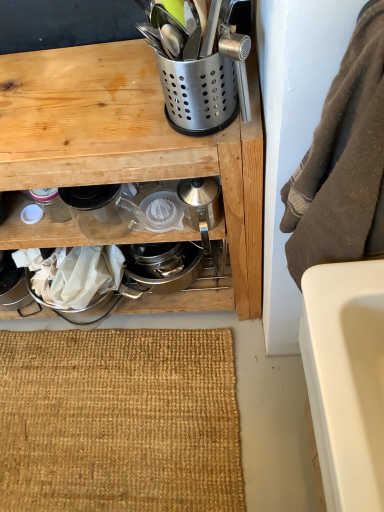
Question: Considering the relative sizes of silver metallic kettle at center, marked as the fifth appliance in a left-to-right arrangement, and clear glass pitcher at center, arranged as the 2th appliance when viewed from the left, in the image provided, is silver metallic kettle at center, marked as the fifth appliance in a left-to-right arrangement, thinner than clear glass pitcher at center, arranged as the 2th appliance when viewed from the left,?

Choices:
 (A) no
 (B) yes

Answer: (B)

Question: Is silver metallic kettle at center, marked as the fifth appliance in a left-to-right arrangement, facing away from clear glass pitcher at center, arranged as the 2th appliance when viewed from the left?

Choices:
 (A) no
 (B) yes

Answer: (A)

Question: Can you confirm if silver metallic kettle at center, which is the first appliance from right to left, is smaller than clear glass pitcher at center, the fourth appliance viewed from the right?

Choices:
 (A) no
 (B) yes

Answer: (B)

Question: Does silver metallic kettle at center, which is the first appliance from right to left, have a greater width compared to clear glass pitcher at center, the fourth appliance viewed from the right?

Choices:
 (A) no
 (B) yes

Answer: (A)

Question: Is the surface of silver metallic kettle at center, marked as the fifth appliance in a left-to-right arrangement, in direct contact with clear glass pitcher at center, the fourth appliance viewed from the right?

Choices:
 (A) yes
 (B) no

Answer: (B)

Question: From a real-world perspective, is metallic silver utensil holder at upper center positioned above or below burlap mat at lower center?

Choices:
 (A) below
 (B) above

Answer: (B)

Question: In the image, is metallic silver utensil holder at upper center positioned in front of or behind burlap mat at lower center?

Choices:
 (A) front
 (B) behind

Answer: (A)

Question: Looking at their shapes, would you say metallic silver utensil holder at upper center is wider or thinner than burlap mat at lower center?

Choices:
 (A) thin
 (B) wide

Answer: (A)

Question: From the image's perspective, is metallic silver utensil holder at upper center located above or below burlap mat at lower center?

Choices:
 (A) above
 (B) below

Answer: (A)

Question: From a real-world perspective, is silver metallic kettle at center, marked as the fifth appliance in a left-to-right arrangement, above or below metallic silver utensil holder at upper center?

Choices:
 (A) above
 (B) below

Answer: (A)

Question: In terms of size, does silver metallic kettle at center, marked as the fifth appliance in a left-to-right arrangement, appear bigger or smaller than metallic silver utensil holder at upper center?

Choices:
 (A) big
 (B) small

Answer: (B)

Question: Would you say silver metallic kettle at center, marked as the fifth appliance in a left-to-right arrangement, is inside or outside metallic silver utensil holder at upper center?

Choices:
 (A) outside
 (B) inside

Answer: (B)

Question: Is silver metallic kettle at center, marked as the fifth appliance in a left-to-right arrangement, wider or thinner than metallic silver utensil holder at upper center?

Choices:
 (A) thin
 (B) wide

Answer: (A)

Question: From the image's perspective, relative to metallic silver utensil holder at upper center, is clear glass pitcher at center, arranged as the 2th appliance when viewed from the left, above or below?

Choices:
 (A) above
 (B) below

Answer: (A)

Question: Is point (102, 238) positioned closer to the camera than point (258, 297)?

Choices:
 (A) farther
 (B) closer

Answer: (B)